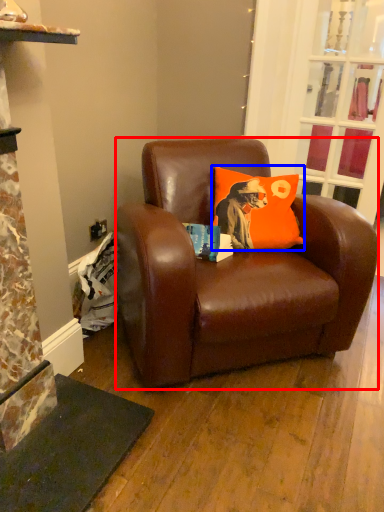
Question: Which of the following is the farthest to the observer, studio couch (highlighted by a red box) or pillow (highlighted by a blue box)?

Choices:
 (A) studio couch
 (B) pillow

Answer: (B)